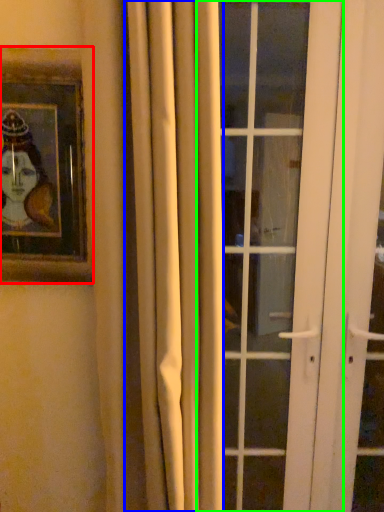
Question: Estimate the real-world distances between objects in this image. Which object is closer to picture frame (highlighted by a red box), curtain (highlighted by a blue box) or door (highlighted by a green box)?

Choices:
 (A) curtain
 (B) door

Answer: (A)